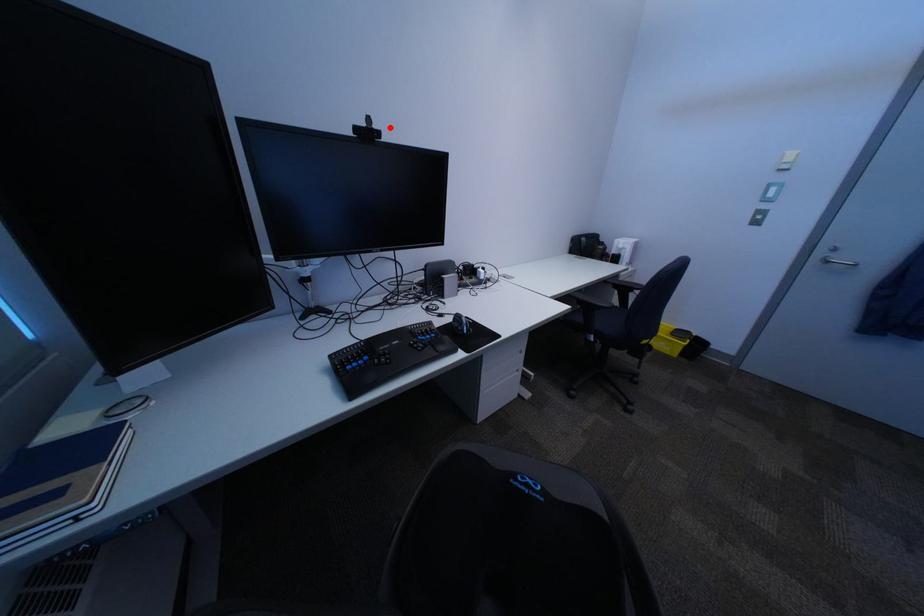
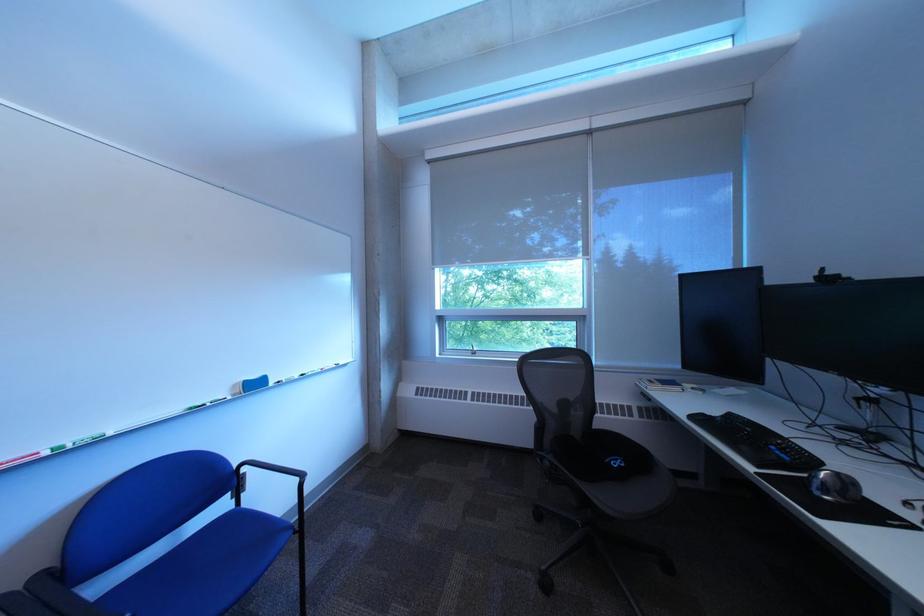
Question: I am providing you with two images of the same scene from different viewpoints. A red point is marked on the first image. Is the red point's position out of view in image 2?

Choices:
 (A) Yes
 (B) No

Answer: (B)